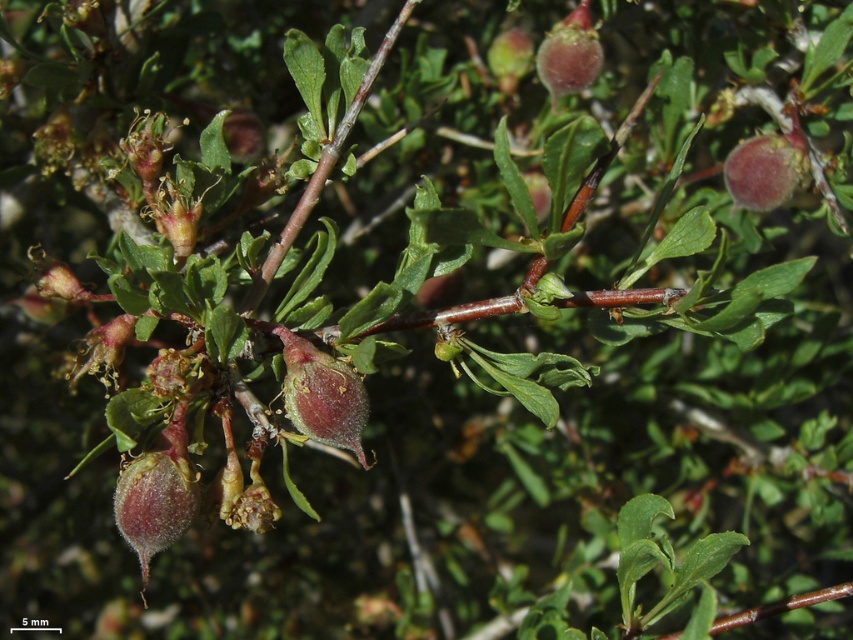
Between pinkish-red glossy berry at upper right and glossy red fruit at upper center, which one has more height?

With more height is glossy red fruit at upper center.

Between pinkish-red glossy berry at upper right and glossy red fruit at upper center, which one is positioned higher?

glossy red fruit at upper center is higher up.

Locate an element on the screen. Image resolution: width=853 pixels, height=640 pixels. pinkish-red glossy berry at upper right is located at coordinates (761, 172).

Locate an element on the screen. The height and width of the screenshot is (640, 853). pinkish-red glossy berry at upper right is located at coordinates (761, 172).

Who is positioned more to the right, pinkish-red glossy berry at center or glossy red fruit at upper center?

glossy red fruit at upper center

I want to click on pinkish-red glossy berry at center, so click(x=321, y=394).

This screenshot has width=853, height=640. I want to click on pinkish-red glossy berry at center, so click(321, 394).

Is point (335, 404) in front of point (735, 148)?

That is True.

Does pinkish-red glossy berry at center appear on the right side of pinkish-red glossy berry at upper right?

Incorrect, pinkish-red glossy berry at center is not on the right side of pinkish-red glossy berry at upper right.

Between point (321, 390) and point (766, 204), which one is positioned behind?

The point (766, 204) is behind.

Find the location of a particular element. The height and width of the screenshot is (640, 853). pinkish-red glossy berry at center is located at coordinates (321, 394).